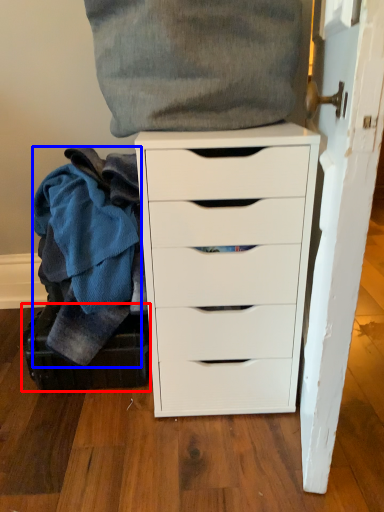
Question: Among these objects, which one is farthest to the camera, luggage (highlighted by a red box) or clothing (highlighted by a blue box)?

Choices:
 (A) luggage
 (B) clothing

Answer: (A)